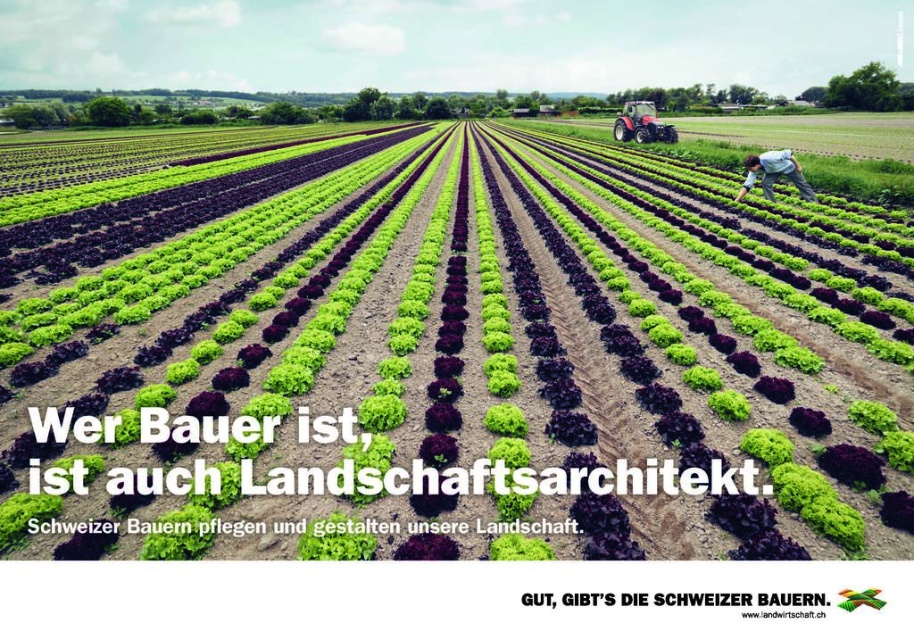
Which is in front, point (339, 529) or point (617, 124)?

Point (339, 529)

Between point (339, 548) and point (622, 112), which one is positioned behind?

The point (622, 112) is behind.

Does point (328, 536) come farther from viewer compared to point (617, 136)?

No, (328, 536) is in front of (617, 136).

Find the location of a particular element. This screenshot has width=914, height=640. green leafy at center is located at coordinates (335, 540).

Can you confirm if green leafy vegetables at center is thinner than green leafy at center?

Incorrect, green leafy vegetables at center's width is not less than green leafy at center's.

The image size is (914, 640). Find the location of `green leafy vegetables at center`. green leafy vegetables at center is located at coordinates click(477, 397).

Is point (469, 202) in front of point (352, 532)?

No.

You are a GUI agent. You are given a task and a screenshot of the screen. Output one action in this format:
    pyautogui.click(x=<x>, y=<y>)
    Task: Click on the green leafy vegetables at center
    This screenshot has width=914, height=640.
    Given the screenshot: What is the action you would take?
    pyautogui.click(x=477, y=397)

Between green leafy vegetables at center and light blue denim jeans at lower right, which one has less height?

light blue denim jeans at lower right

Does green leafy vegetables at center have a smaller size compared to light blue denim jeans at lower right?

Actually, green leafy vegetables at center might be larger than light blue denim jeans at lower right.

Between point (33, 410) and point (756, 170), which one is positioned behind?

Point (756, 170)

Where is `green leafy vegetables at center`? green leafy vegetables at center is located at coordinates tap(477, 397).